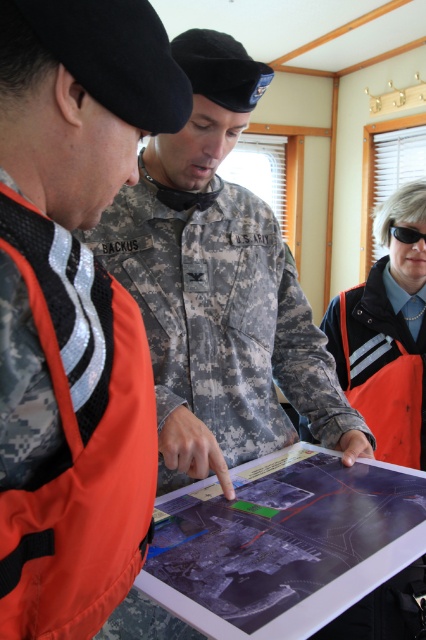
You are a swimmer preparing for a competition and see the orange fabric life jacket at left and the black plastic goggles at center. Which item is closer to your left side?

The orange fabric life jacket at left is closer to your left side because it is positioned to the left of the black plastic goggles at center.

Consider the image. You are a lifeguard at a pool and need to choose between the orange fabric life jacket at left and the orange reflective vest at center. Which one would you choose to wear for better visibility during night patrols?

The orange reflective vest at center is better for night patrols because it is thicker than the orange fabric life jacket at left, providing more reflective surface area.